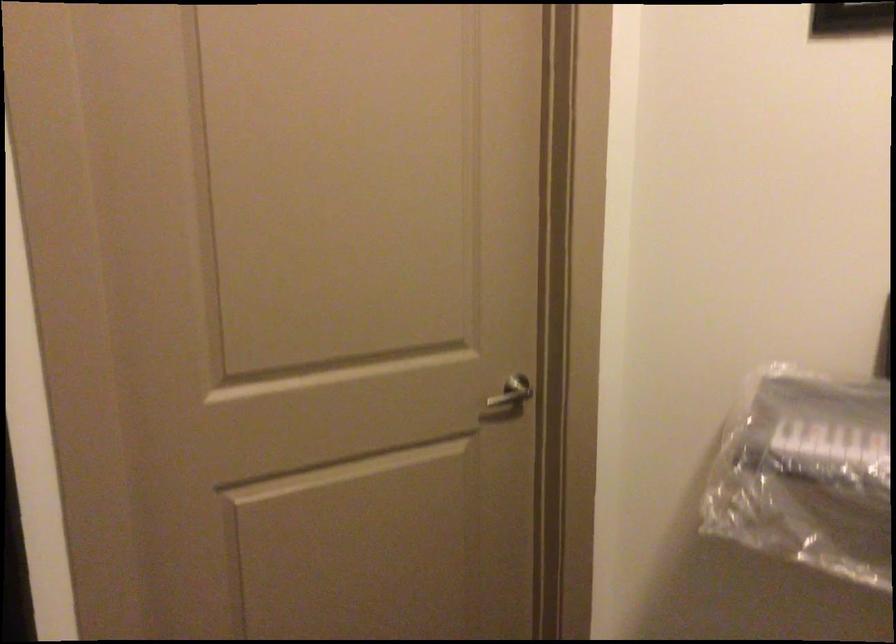
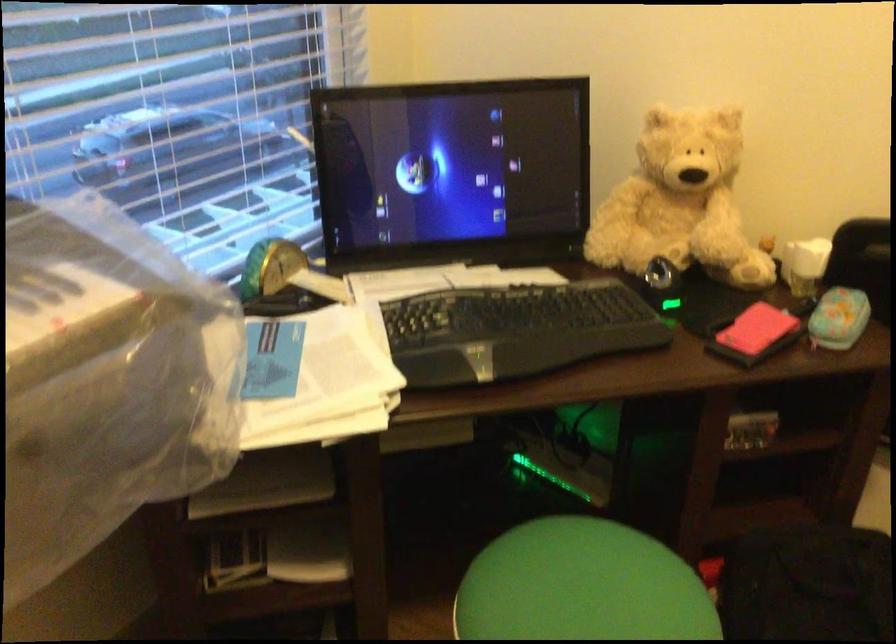
How did the camera likely rotate?

The camera rotated toward right-down.